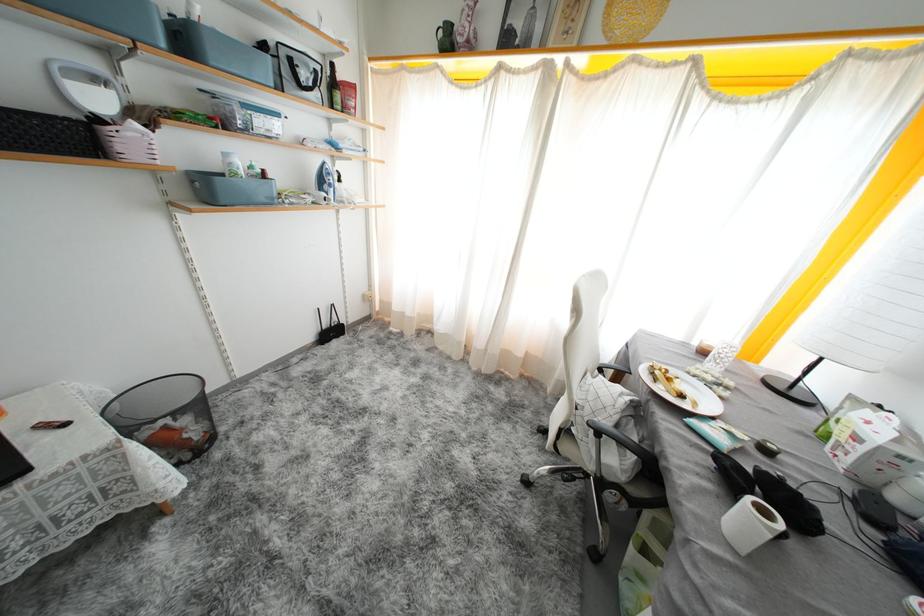
Identify the location of black smartphone. (51, 424).